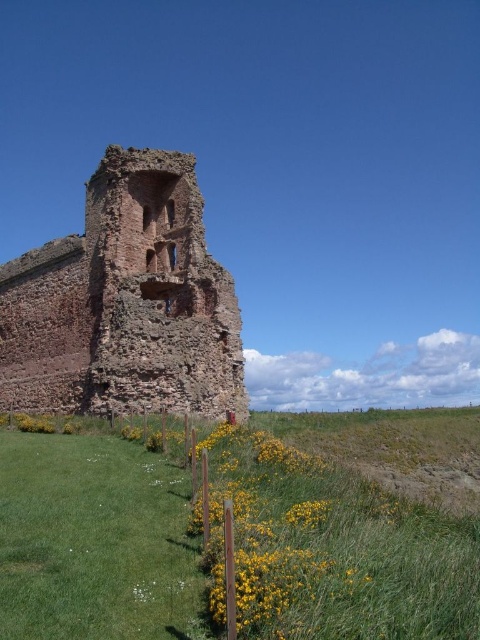
Consider the image. You are standing in the field and see the green grass at lower left and the rustic stone ruins at center. Which object is closer to you?

The green grass at lower left is closer to you because it has a smaller size compared to the rustic stone ruins at center, indicating it is nearer.

You are standing in a field and see the green grass at lower left and the rustic stone ruins at center. Which object is located to the right of the other?

The green grass at lower left is positioned on the right side of rustic stone ruins at center, so the green grass at lower left is to the right of the rustic stone ruins at center.